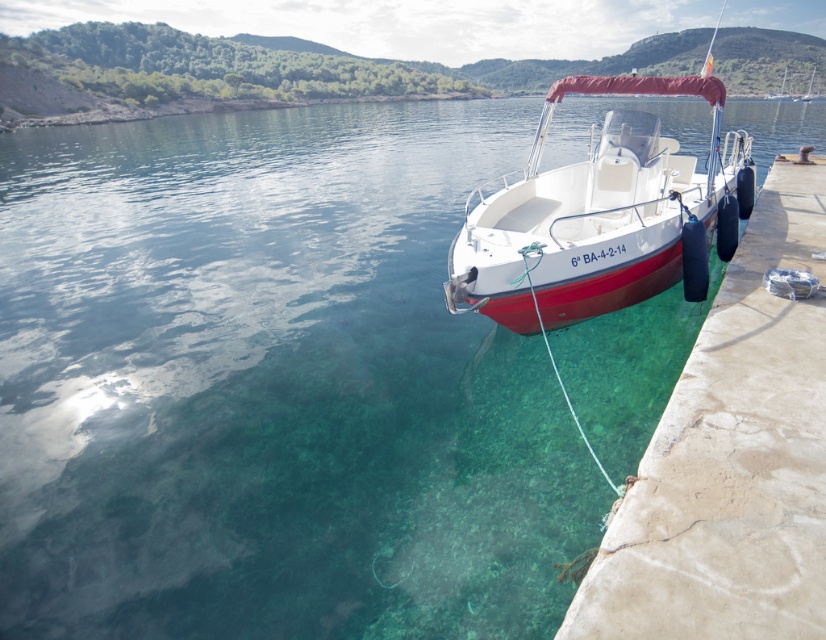
Question: Can you confirm if concrete at right is positioned below white glossy boat at right?

Choices:
 (A) yes
 (B) no

Answer: (A)

Question: Can you confirm if concrete at right is positioned to the left of white glossy boat at right?

Choices:
 (A) yes
 (B) no

Answer: (A)

Question: Is concrete at right closer to the viewer compared to white glossy boat at right?

Choices:
 (A) no
 (B) yes

Answer: (B)

Question: Which point is closer to the camera?

Choices:
 (A) (813, 221)
 (B) (743, 138)

Answer: (A)

Question: Which of the following is the farthest from the observer?

Choices:
 (A) (616, 141)
 (B) (724, 339)

Answer: (A)

Question: Which point is farther from the camera taking this photo?

Choices:
 (A) (746, 225)
 (B) (646, 196)

Answer: (A)